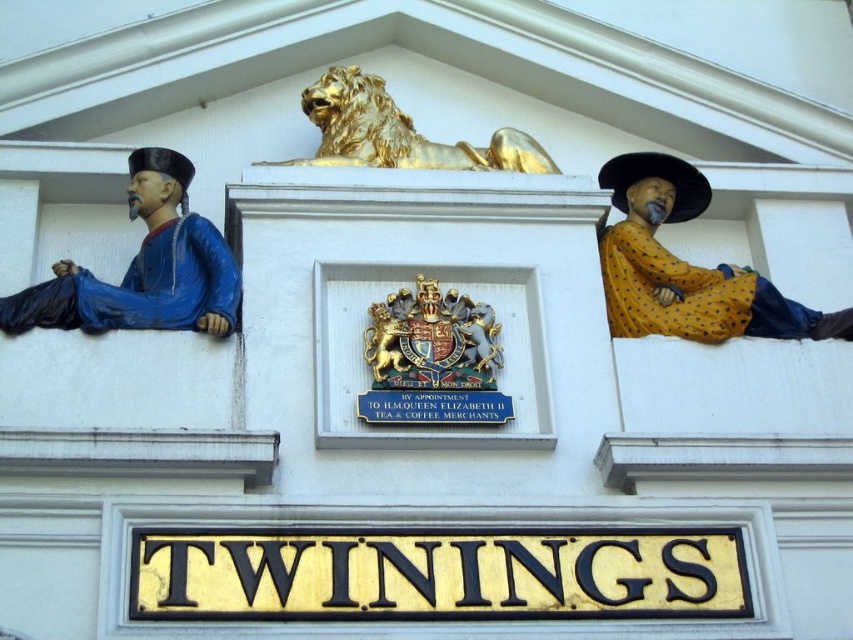
Question: Can you confirm if blue painted wood figure at left is bigger than gold metallic lion at center?

Choices:
 (A) yes
 (B) no

Answer: (A)

Question: Which of these objects is positioned farthest from the gold metallic lion at center?

Choices:
 (A) gold metallic coat of arms at center
 (B) blue painted wood figure at left

Answer: (A)

Question: Can you confirm if yellow dotted fabric at right is positioned below gold metallic coat of arms at center?

Choices:
 (A) yes
 (B) no

Answer: (B)

Question: Which of the following is the farthest from the observer?

Choices:
 (A) blue painted wood figure at left
 (B) gold metallic coat of arms at center
 (C) gold metallic lion at center
 (D) yellow dotted fabric at right

Answer: (C)

Question: Is blue painted wood figure at left to the right of gold metallic lion at center from the viewer's perspective?

Choices:
 (A) no
 (B) yes

Answer: (A)

Question: Which point is closer to the camera?

Choices:
 (A) (426, 296)
 (B) (315, 100)
 (C) (781, 298)
 (D) (80, 268)

Answer: (A)